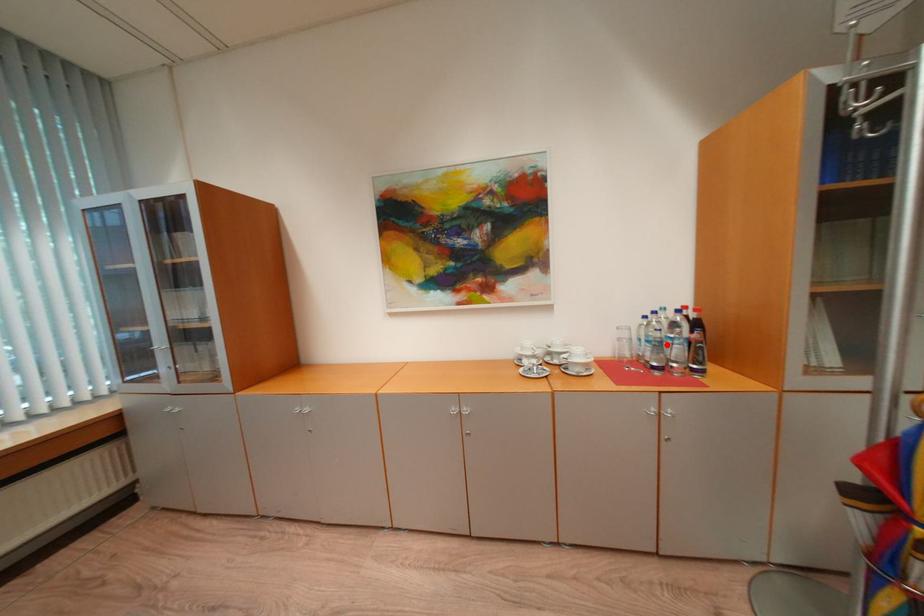
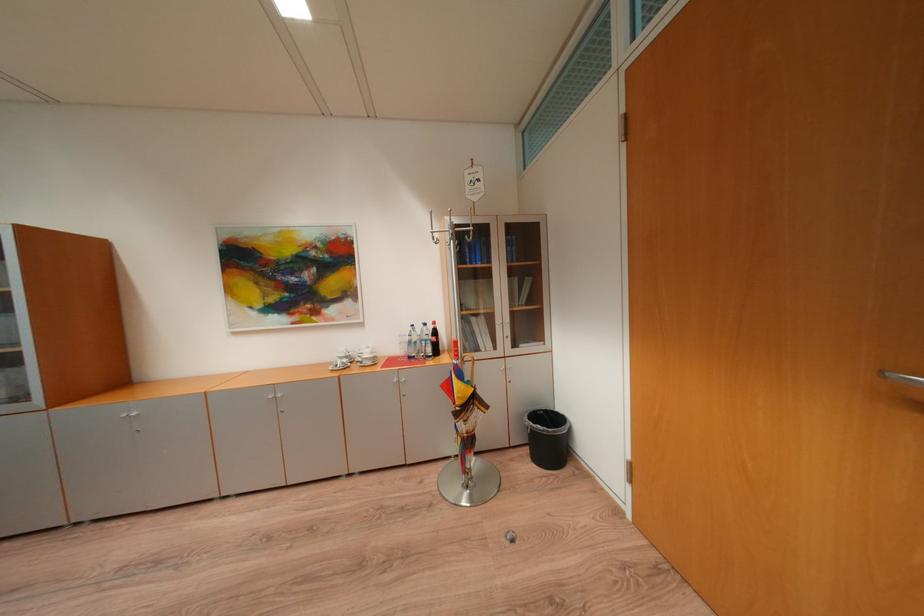
Locate, in the second image, the point that corresponds to the highlighted location in the first image.

(419, 344)